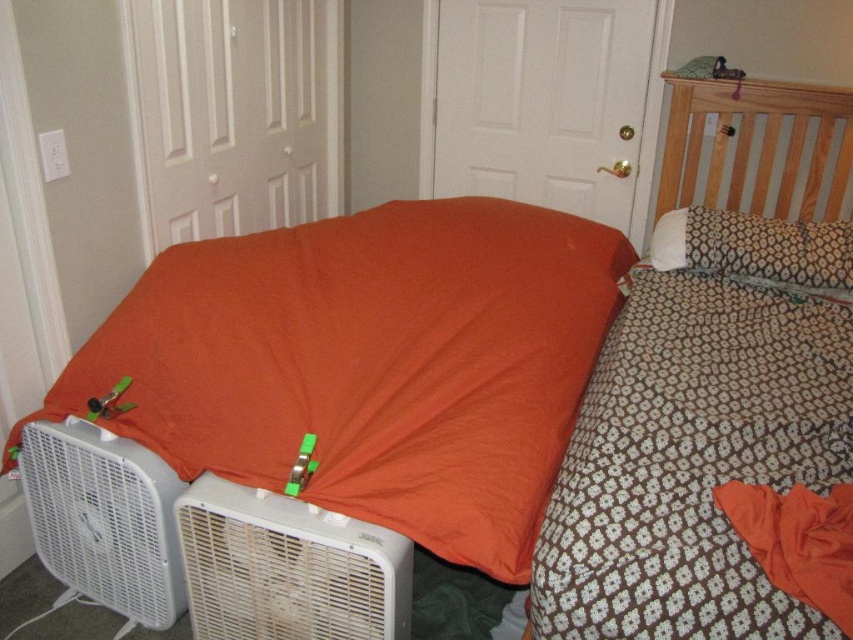
Question: Can you confirm if brown printed fabric bed at upper right is wider than white textured pillow at upper right?

Choices:
 (A) no
 (B) yes

Answer: (B)

Question: From the image, what is the correct spatial relationship of orange fabric at left in relation to white textured pillow at upper right?

Choices:
 (A) left
 (B) right

Answer: (A)

Question: Which object is farther from the camera taking this photo?

Choices:
 (A) white plastic air conditioner at lower left
 (B) white textured pillow at upper right
 (C) brown printed fabric bed at upper right

Answer: (B)

Question: Which of the following is the farthest from the observer?

Choices:
 (A) (264, 627)
 (B) (224, 333)
 (C) (689, 212)
 (D) (787, 332)

Answer: (C)

Question: Can you confirm if white plastic fan at lower left is positioned above white textured pillow at upper right?

Choices:
 (A) yes
 (B) no

Answer: (B)

Question: Which object is closer to the camera taking this photo?

Choices:
 (A) white plastic fan at lower left
 (B) white textured pillow at upper right

Answer: (A)